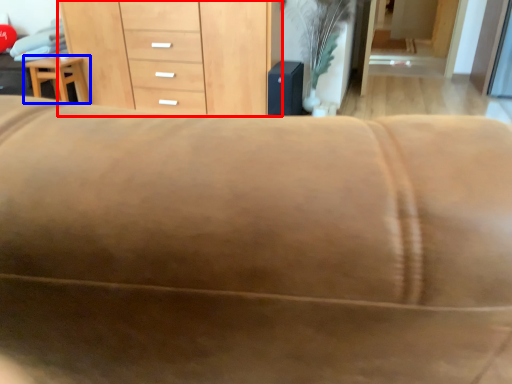
Question: Which point is closer to the camera, chest of drawers (highlighted by a red box) or furniture (highlighted by a blue box)?

Choices:
 (A) chest of drawers
 (B) furniture

Answer: (A)